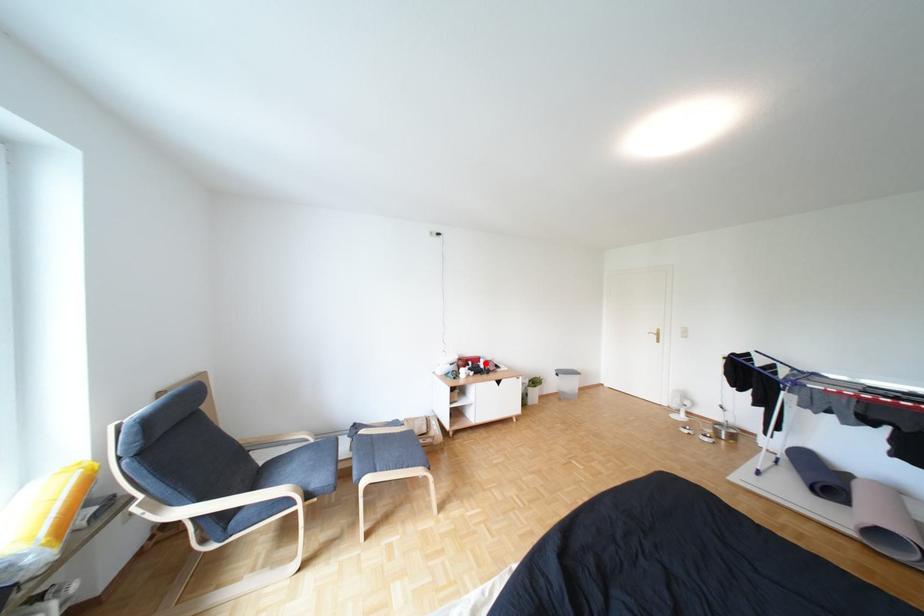
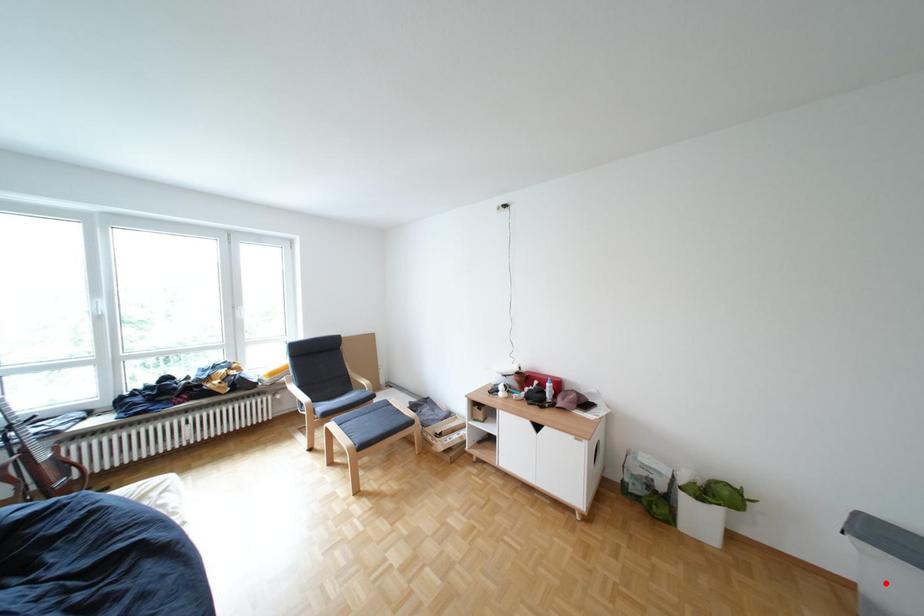
I am providing you with two images of the same scene from different viewpoints. A red point is marked on the first image and another point is marked on the second image. Does the point marked in image1 correspond to the same location as the one in image2?

No